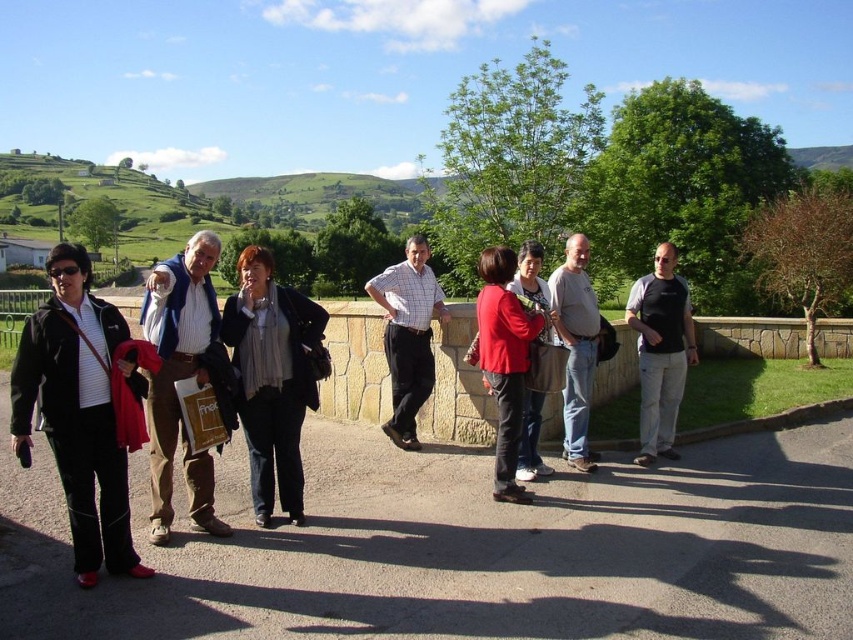
You are standing at the point with coordinates point [410,291] and want to walk towards the point with coordinates point [637,291]. Which direction should you face to move towards it?

You should face north because point [637,291] is in front of point [410,291], which means it is north of your current position.

You are standing at the origin point of the image. Which direction should you move to reach the black matte shirt at center?

The black matte shirt at center is located at point 0.550 along the x and 0.775 along the y, so you should move towards the right and upwards to reach it.